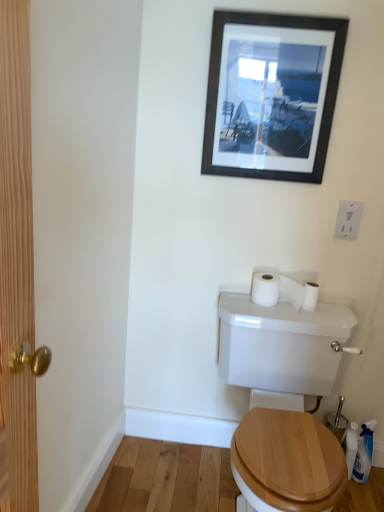
Question: Is white glossy toilet at center oriented towards white plastic switch at upper right?

Choices:
 (A) yes
 (B) no

Answer: (B)

Question: Does white glossy toilet at center appear on the left side of white plastic switch at upper right?

Choices:
 (A) no
 (B) yes

Answer: (B)

Question: From a real-world perspective, is white glossy toilet at center positioned over white plastic switch at upper right based on gravity?

Choices:
 (A) yes
 (B) no

Answer: (B)

Question: Is white glossy toilet at center further to camera compared to white plastic switch at upper right?

Choices:
 (A) no
 (B) yes

Answer: (A)

Question: From a real-world perspective, is white glossy toilet at center positioned under white plastic switch at upper right based on gravity?

Choices:
 (A) no
 (B) yes

Answer: (B)

Question: From the image's perspective, is white matte toilet paper at upper right, which is counted as the second toilet paper, starting from the right, located above or below black matte picture frame at upper center?

Choices:
 (A) below
 (B) above

Answer: (A)

Question: In terms of width, does white matte toilet paper at upper right, the first toilet paper from the left, look wider or thinner when compared to black matte picture frame at upper center?

Choices:
 (A) wide
 (B) thin

Answer: (A)

Question: In the image, is white matte toilet paper at upper right, which is counted as the second toilet paper, starting from the right, positioned in front of or behind black matte picture frame at upper center?

Choices:
 (A) behind
 (B) front

Answer: (A)

Question: In terms of height, does white matte toilet paper at upper right, which is counted as the second toilet paper, starting from the right, look taller or shorter compared to black matte picture frame at upper center?

Choices:
 (A) short
 (B) tall

Answer: (A)

Question: Looking at the image, does white matte toilet paper at upper right, the 2th toilet paper positioned from the left, seem bigger or smaller compared to white plastic switch at upper right?

Choices:
 (A) small
 (B) big

Answer: (B)

Question: Is white matte toilet paper at upper right, the 2th toilet paper positioned from the left, wider or thinner than white plastic switch at upper right?

Choices:
 (A) wide
 (B) thin

Answer: (A)

Question: Do you think white matte toilet paper at upper right, the 2th toilet paper positioned from the left, is within white plastic switch at upper right, or outside of it?

Choices:
 (A) inside
 (B) outside

Answer: (B)

Question: Considering the positions of white matte toilet paper at upper right, positioned as the first toilet paper in right-to-left order, and white plastic switch at upper right in the image, is white matte toilet paper at upper right, positioned as the first toilet paper in right-to-left order, taller or shorter than white plastic switch at upper right?

Choices:
 (A) tall
 (B) short

Answer: (B)

Question: Is point (306, 304) positioned closer to the camera than point (319, 488)?

Choices:
 (A) farther
 (B) closer

Answer: (A)

Question: Considering the positions of white matte toilet paper at upper right, the 2th toilet paper positioned from the left, and white glossy toilet at center in the image, is white matte toilet paper at upper right, the 2th toilet paper positioned from the left, wider or thinner than white glossy toilet at center?

Choices:
 (A) thin
 (B) wide

Answer: (A)